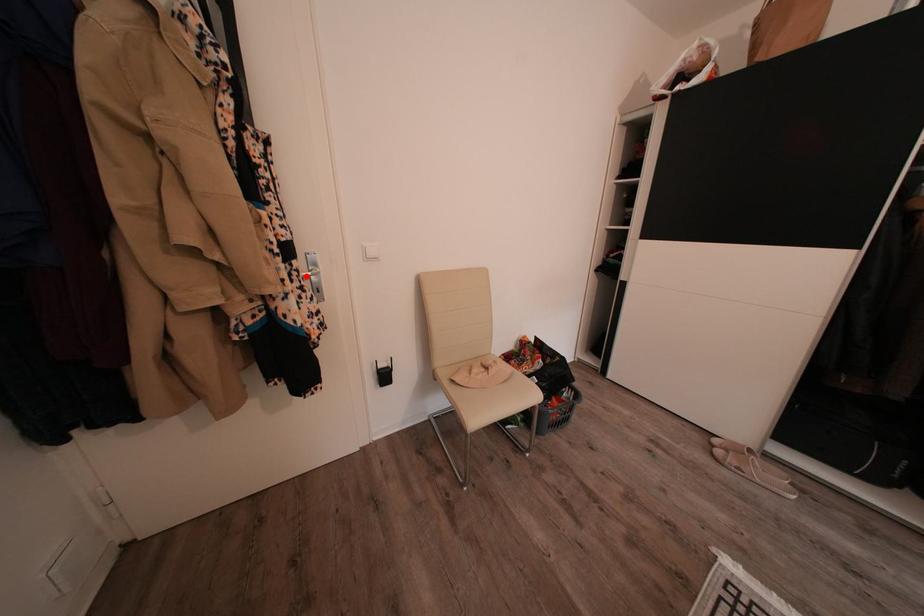
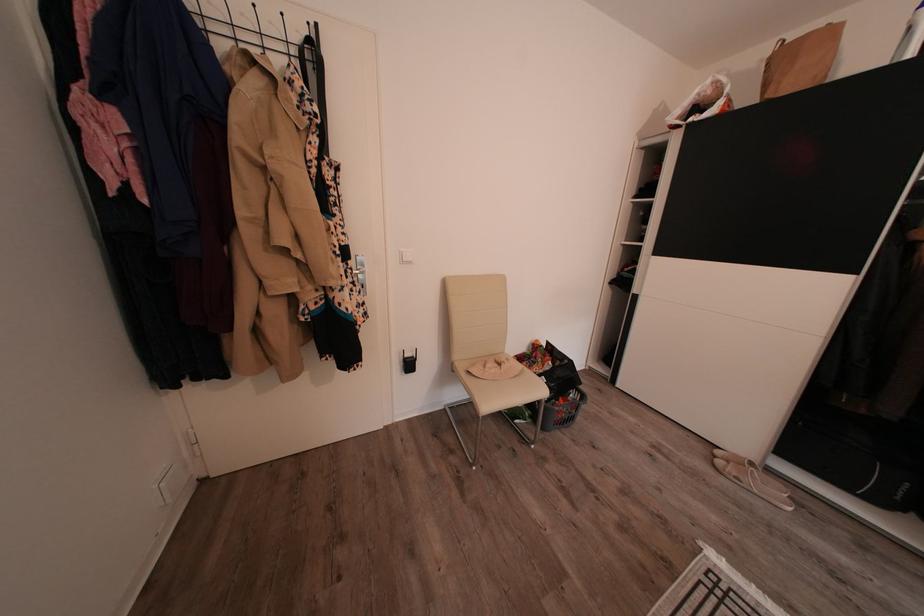
Locate, in the second image, the point that corresponds to the highlighted location in the first image.

(359, 274)